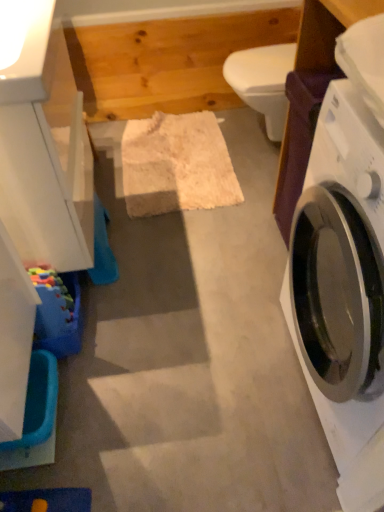
At what (x,y) coordinates should I click in order to perform the action: click on white glossy toilet bowl at center. Please return your answer as a coordinate pair (x, y). Image resolution: width=384 pixels, height=512 pixels. Looking at the image, I should click on (263, 82).

At what (x,y) coordinates should I click in order to perform the action: click on white glossy washing machine at right. Please return your answer as a coordinate pair (x, y). The height and width of the screenshot is (512, 384). Looking at the image, I should click on pyautogui.click(x=342, y=288).

Is blue plastic tub at lower left wider or thinner than white glossy toilet bowl at center?

Clearly, blue plastic tub at lower left has less width compared to white glossy toilet bowl at center.

From the image's perspective, is blue plastic tub at lower left on top of white glossy toilet bowl at center?

No.

Is blue plastic tub at lower left to the right of white glossy toilet bowl at center from the viewer's perspective?

No, blue plastic tub at lower left is not to the right of white glossy toilet bowl at center.

Between blue plastic tub at lower left and white glossy toilet bowl at center, which one has more height?

white glossy toilet bowl at center is taller.

Could you tell me if white glossy toilet bowl at center is turned towards white glossy washing machine at right?

No, white glossy toilet bowl at center is not turned towards white glossy washing machine at right.

How different are the orientations of white glossy toilet bowl at center and white glossy washing machine at right in degrees?

1.39 degrees.

Between white glossy toilet bowl at center and white glossy washing machine at right, which one has smaller width?

white glossy toilet bowl at center.

Which object is closer to the camera, blue plastic tub at lower left or white glossy washing machine at right?

white glossy washing machine at right is in front.

Does blue plastic tub at lower left touch white glossy washing machine at right?

blue plastic tub at lower left and white glossy washing machine at right are not in contact.

Considering the sizes of objects blue plastic tub at lower left and white glossy washing machine at right in the image provided, who is shorter, blue plastic tub at lower left or white glossy washing machine at right?

With less height is blue plastic tub at lower left.

From the image's perspective, does white glossy washing machine at right appear lower than blue plastic tub at lower left?

No, from the image's perspective, white glossy washing machine at right is not below blue plastic tub at lower left.

From their relative heights in the image, would you say white glossy washing machine at right is taller or shorter than blue plastic tub at lower left?

In the image, white glossy washing machine at right appears to be taller than blue plastic tub at lower left.

Is white glossy washing machine at right aimed at blue plastic tub at lower left?

Yes, white glossy washing machine at right is oriented towards blue plastic tub at lower left.

Looking at this image, in the image, is white glossy washing machine at right on the left side or the right side of blue plastic tub at lower left?

Clearly, white glossy washing machine at right is on the right of blue plastic tub at lower left in the image.

Is white glossy toilet bowl at center positioned beyond the bounds of blue plastic tub at lower left?

That's correct, white glossy toilet bowl at center is outside of blue plastic tub at lower left.

From their relative heights in the image, would you say white glossy toilet bowl at center is taller or shorter than blue plastic tub at lower left?

Clearly, white glossy toilet bowl at center is taller compared to blue plastic tub at lower left.

From a real-world perspective, is white glossy toilet bowl at center located beneath blue plastic tub at lower left?

No, from a real-world perspective, white glossy toilet bowl at center is not under blue plastic tub at lower left.

From a real-world perspective, is white glossy washing machine at right physically above white glossy toilet bowl at center?

Yes, from a real-world perspective, white glossy washing machine at right is above white glossy toilet bowl at center.

Does white glossy washing machine at right have a larger size compared to white glossy toilet bowl at center?

Yes, white glossy washing machine at right is bigger than white glossy toilet bowl at center.

Is point (357, 209) less distant than point (249, 63)?

That is True.

Is white glossy washing machine at right facing away from white glossy toilet bowl at center?

white glossy washing machine at right is not turned away from white glossy toilet bowl at center.

I want to click on washer on the left of the white glossy toilet bowl at center, so click(x=36, y=417).

Identify the location of toilet bowl located underneath the white glossy washing machine at right (from a real-world perspective). (263, 82).

Estimate the real-world distances between objects in this image. Which object is further from white glossy washing machine at right, white glossy toilet bowl at center or blue plastic tub at lower left?

Among the two, blue plastic tub at lower left is located further to white glossy washing machine at right.

Estimate the real-world distances between objects in this image. Which object is closer to blue plastic tub at lower left, white glossy washing machine at right or white glossy toilet bowl at center?

white glossy washing machine at right is closer to blue plastic tub at lower left.

From the image, which object appears to be farther from white glossy washing machine at right, blue plastic tub at lower left or white glossy toilet bowl at center?

blue plastic tub at lower left lies further to white glossy washing machine at right than the other object.

Which object lies nearer to the anchor point white glossy toilet bowl at center, white glossy washing machine at right or blue plastic tub at lower left?

Among the two, white glossy washing machine at right is located nearer to white glossy toilet bowl at center.

From the image, which object appears to be farther from white glossy toilet bowl at center, blue plastic tub at lower left or white glossy washing machine at right?

The object further to white glossy toilet bowl at center is blue plastic tub at lower left.

When comparing their distances from blue plastic tub at lower left, does white glossy toilet bowl at center or white glossy washing machine at right seem closer?

Based on the image, white glossy washing machine at right appears to be nearer to blue plastic tub at lower left.

Where is `washing machine between white glossy toilet bowl at center and blue plastic tub at lower left in the vertical direction`? Image resolution: width=384 pixels, height=512 pixels. washing machine between white glossy toilet bowl at center and blue plastic tub at lower left in the vertical direction is located at coordinates (342, 288).